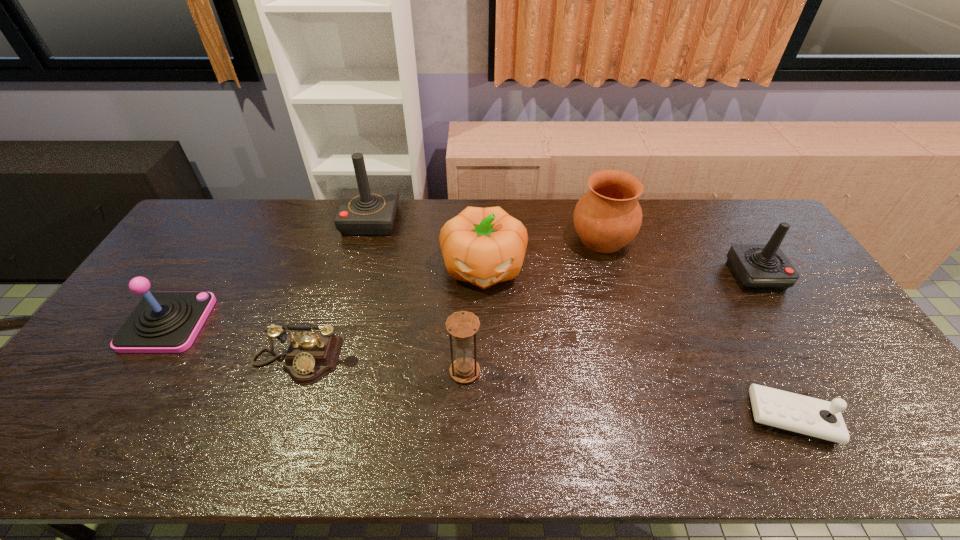
At what (x,y) coordinates should I click in order to perform the action: click on the nearest object. Please return your answer as a coordinate pair (x, y). This screenshot has height=540, width=960. Looking at the image, I should click on (790, 412).

Find the location of a particular element. free location located on the rectangular base of the third joystick from right to left is located at coordinates (447, 220).

Locate an element on the screen. Image resolution: width=960 pixels, height=540 pixels. blank space located 0.210m on the left of the pottery is located at coordinates (509, 239).

Locate an element on the screen. The image size is (960, 540). vacant space situated on the carved face of the pumpkin is located at coordinates (485, 402).

Where is `free space located 0.100m on the front-facing side of the third nearest joystick`? The image size is (960, 540). free space located 0.100m on the front-facing side of the third nearest joystick is located at coordinates (782, 318).

At what (x,y) coordinates should I click in order to perform the action: click on free point located on the left of the hourglass. Please return your answer as a coordinate pair (x, y). Image resolution: width=960 pixels, height=540 pixels. Looking at the image, I should click on (426, 372).

Locate an element on the screen. This screenshot has height=540, width=960. vacant area situated forward from the base of the second nearest joystick is located at coordinates (236, 323).

This screenshot has height=540, width=960. In order to click on blank space located on the dial of the second shortest object in this screenshot , I will do `click(265, 452)`.

Image resolution: width=960 pixels, height=540 pixels. Find the location of `free space located on the left of the shortest object`. free space located on the left of the shortest object is located at coordinates (644, 417).

Locate an element on the screen. The width and height of the screenshot is (960, 540). joystick positioned at the far edge is located at coordinates (363, 211).